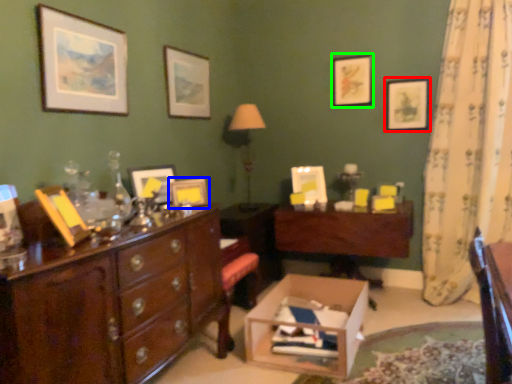
Question: Considering the real-world distances, which object is farthest from picture frame (highlighted by a red box)? picture frame (highlighted by a blue box) or picture frame (highlighted by a green box)?

Choices:
 (A) picture frame
 (B) picture frame

Answer: (A)